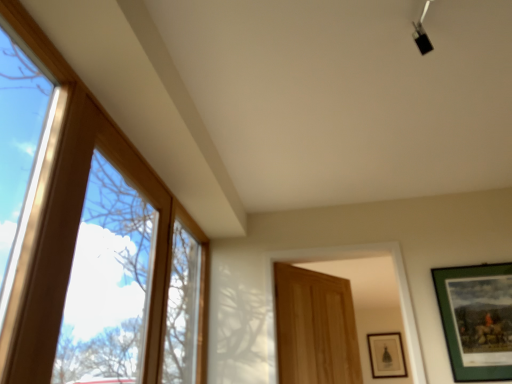
The width and height of the screenshot is (512, 384). Describe the element at coordinates (386, 355) in the screenshot. I see `green matte picture frame at lower right, acting as the 2th picture frame starting from the top` at that location.

This screenshot has width=512, height=384. What do you see at coordinates (476, 318) in the screenshot? I see `green matte picture frame at right, which is the 1th picture frame from top to bottom` at bounding box center [476, 318].

Measure the distance between wooden door at center and camera.

A distance of 2.39 meters exists between wooden door at center and camera.

Describe the element at coordinates (315, 328) in the screenshot. This screenshot has width=512, height=384. I see `wooden door at center` at that location.

Find the location of a particular element. The height and width of the screenshot is (384, 512). clear glass window at left is located at coordinates (91, 242).

Is green matte picture frame at lower right, which is the first picture frame in right-to-left order, directly adjacent to green matte picture frame at right, acting as the first picture frame starting from the left?

No, green matte picture frame at lower right, which is the first picture frame in right-to-left order, is not in contact with green matte picture frame at right, acting as the first picture frame starting from the left.

Does green matte picture frame at lower right, the 1th picture frame when ordered from back to front, turn towards green matte picture frame at right, acting as the first picture frame starting from the left?

Yes, green matte picture frame at lower right, the 1th picture frame when ordered from back to front, faces towards green matte picture frame at right, acting as the first picture frame starting from the left.

Is green matte picture frame at lower right, which is the 2th picture frame in left-to-right order, located outside green matte picture frame at right, acting as the first picture frame starting from the left?

Yes.

From the picture: Is clear glass window at left bigger or smaller than green matte picture frame at lower right, the 1th picture frame when ordered from back to front?

In the image, clear glass window at left appears to be larger than green matte picture frame at lower right, the 1th picture frame when ordered from back to front.

Looking at this image, which point is more distant from viewer, (23, 206) or (389, 352)?

The point (389, 352) is farther from the camera.

Considering the positions of objects clear glass window at left and green matte picture frame at lower right, which is the first picture frame in right-to-left order, in the image provided, who is more to the left, clear glass window at left or green matte picture frame at lower right, which is the first picture frame in right-to-left order,?

clear glass window at left.

Is clear glass window at left taller than green matte picture frame at lower right, acting as the 2th picture frame starting from the top?

Yes.

Considering the positions of objects wooden door at center and green matte picture frame at right, which is the 2th picture frame from bottom to top, in the image provided, who is more to the right, wooden door at center or green matte picture frame at right, which is the 2th picture frame from bottom to top,?

green matte picture frame at right, which is the 2th picture frame from bottom to top.

Is point (310, 377) closer to camera compared to point (476, 356)?

No, (310, 377) is further to viewer.

Is wooden door at center directly adjacent to green matte picture frame at right, marked as the second picture frame in a right-to-left arrangement?

No, wooden door at center is not next to green matte picture frame at right, marked as the second picture frame in a right-to-left arrangement.

Would you say wooden door at center is outside green matte picture frame at right, acting as the first picture frame starting from the left?

That's correct, wooden door at center is outside of green matte picture frame at right, acting as the first picture frame starting from the left.

Is wooden door at center at the right side of green matte picture frame at lower right, which is the 2th picture frame in left-to-right order?

No, wooden door at center is not to the right of green matte picture frame at lower right, which is the 2th picture frame in left-to-right order.

Is wooden door at center positioned with its back to green matte picture frame at lower right, which is the first picture frame in right-to-left order?

No, wooden door at center is not facing the opposite direction of green matte picture frame at lower right, which is the first picture frame in right-to-left order.

Considering the positions of points (305, 327) and (382, 344), is point (305, 327) closer to camera compared to point (382, 344)?

Yes, it is in front of point (382, 344).

Between wooden door at center and green matte picture frame at lower right, which is the first picture frame in right-to-left order, which one has larger width?

wooden door at center is wider.

Is green matte picture frame at right, placed as the 1th picture frame when sorted from front to back, spatially inside clear glass window at left, or outside of it?

The correct answer is: outside.

Considering their positions, is green matte picture frame at right, which is the 1th picture frame from top to bottom, located in front of or behind clear glass window at left?

green matte picture frame at right, which is the 1th picture frame from top to bottom, is positioned farther from the viewer than clear glass window at left.

Considering the relative sizes of green matte picture frame at right, the second picture frame from the back, and clear glass window at left in the image provided, is green matte picture frame at right, the second picture frame from the back, shorter than clear glass window at left?

Yes, green matte picture frame at right, the second picture frame from the back, is shorter than clear glass window at left.

Where is `picture frame above the wooden door at center (from the image's perspective)`? picture frame above the wooden door at center (from the image's perspective) is located at coordinates (476, 318).

Looking at this image, considering the relative positions of green matte picture frame at right, marked as the second picture frame in a right-to-left arrangement, and wooden door at center in the image provided, is green matte picture frame at right, marked as the second picture frame in a right-to-left arrangement, to the left or to the right of wooden door at center?

From the image, it's evident that green matte picture frame at right, marked as the second picture frame in a right-to-left arrangement, is to the right of wooden door at center.

Which object is wider, green matte picture frame at right, the second picture frame from the back, or wooden door at center?

Wider between the two is wooden door at center.

Considering the relative sizes of green matte picture frame at right, which is the 2th picture frame from bottom to top, and wooden door at center in the image provided, is green matte picture frame at right, which is the 2th picture frame from bottom to top, shorter than wooden door at center?

Yes.

Is green matte picture frame at lower right, the first picture frame from the bottom, at the left side of clear glass window at left?

No, green matte picture frame at lower right, the first picture frame from the bottom, is not to the left of clear glass window at left.

Considering the relative positions of green matte picture frame at lower right, which appears as the second picture frame when viewed from the front, and clear glass window at left in the image provided, is green matte picture frame at lower right, which appears as the second picture frame when viewed from the front, in front of clear glass window at left?

No, green matte picture frame at lower right, which appears as the second picture frame when viewed from the front, is further to the viewer.

Is green matte picture frame at lower right, the 1th picture frame when ordered from back to front, oriented away from clear glass window at left?

No, green matte picture frame at lower right, the 1th picture frame when ordered from back to front, is not facing the opposite direction of clear glass window at left.

The height and width of the screenshot is (384, 512). I want to click on picture frame below the green matte picture frame at right, marked as the second picture frame in a right-to-left arrangement (from the image's perspective), so click(386, 355).

The height and width of the screenshot is (384, 512). Identify the location of window located underneath the green matte picture frame at lower right, acting as the 2th picture frame starting from the top (from a real-world perspective). (91, 242).

Estimate the real-world distances between objects in this image. Which object is further from green matte picture frame at lower right, the first picture frame from the bottom, green matte picture frame at right, which is the 1th picture frame from top to bottom, or wooden door at center?

Based on the image, green matte picture frame at right, which is the 1th picture frame from top to bottom, appears to be further to green matte picture frame at lower right, the first picture frame from the bottom.

Estimate the real-world distances between objects in this image. Which object is further from green matte picture frame at lower right, which is the first picture frame in right-to-left order, wooden door at center or clear glass window at left?

The object further to green matte picture frame at lower right, which is the first picture frame in right-to-left order, is clear glass window at left.

When comparing their distances from clear glass window at left, does green matte picture frame at right, which is the 1th picture frame from top to bottom, or wooden door at center seem closer?

Based on the image, wooden door at center appears to be nearer to clear glass window at left.

When comparing their distances from green matte picture frame at right, which is the 1th picture frame from top to bottom, does green matte picture frame at lower right, the 1th picture frame when ordered from back to front, or wooden door at center seem further?

green matte picture frame at lower right, the 1th picture frame when ordered from back to front, lies further to green matte picture frame at right, which is the 1th picture frame from top to bottom, than the other object.

When comparing their distances from wooden door at center, does green matte picture frame at right, which is the 1th picture frame from top to bottom, or green matte picture frame at lower right, the first picture frame from the bottom, seem closer?

Among the two, green matte picture frame at right, which is the 1th picture frame from top to bottom, is located nearer to wooden door at center.

From the image, which object appears to be nearer to clear glass window at left, wooden door at center or green matte picture frame at right, marked as the second picture frame in a right-to-left arrangement?

Among the two, wooden door at center is located nearer to clear glass window at left.

Based on their spatial positions, is green matte picture frame at lower right, acting as the 2th picture frame starting from the top, or clear glass window at left closer to wooden door at center?

clear glass window at left is closer to wooden door at center.

In the scene shown: When comparing their distances from clear glass window at left, does green matte picture frame at lower right, the first picture frame from the bottom, or green matte picture frame at right, placed as the 1th picture frame when sorted from front to back, seem further?

Based on the image, green matte picture frame at lower right, the first picture frame from the bottom, appears to be further to clear glass window at left.

Find the location of a particular element. The width and height of the screenshot is (512, 384). picture frame between clear glass window at left and green matte picture frame at lower right, which is the 2th picture frame in left-to-right order, in the front-back direction is located at coordinates (476, 318).

Locate an element on the screen. This screenshot has width=512, height=384. door between clear glass window at left and green matte picture frame at right, acting as the first picture frame starting from the left, in the horizontal direction is located at coordinates (315, 328).

This screenshot has height=384, width=512. I want to click on door positioned between green matte picture frame at right, the second picture frame from the back, and green matte picture frame at lower right, acting as the 2th picture frame starting from the top, from near to far, so click(315, 328).

The width and height of the screenshot is (512, 384). Find the location of `door between clear glass window at left and green matte picture frame at lower right, the first picture frame from the bottom, in the front-back direction`. door between clear glass window at left and green matte picture frame at lower right, the first picture frame from the bottom, in the front-back direction is located at coordinates (315, 328).